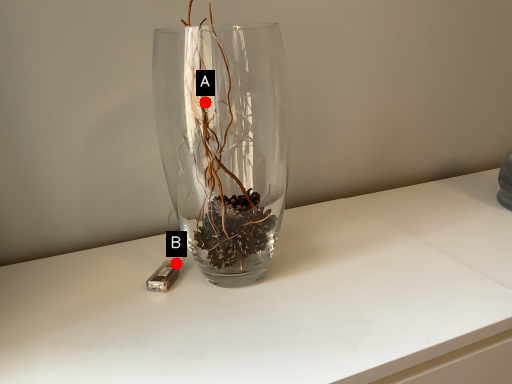
Question: Two points are circled on the image, labeled by A and B beside each circle. Which point is closer to the camera?

Choices:
 (A) A is closer
 (B) B is closer

Answer: (A)